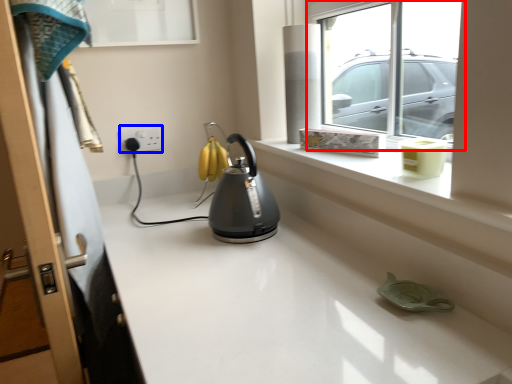
Question: Which object appears farthest to the camera in this image, window (highlighted by a red box) or electric outlet (highlighted by a blue box)?

Choices:
 (A) window
 (B) electric outlet

Answer: (B)